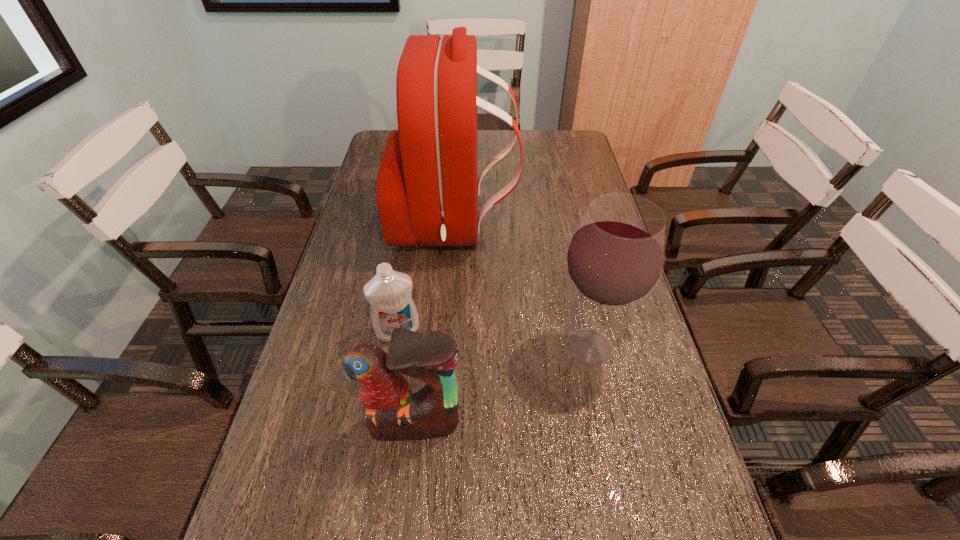
Where is `free point that satisfies the following two spatial constraints: 1. on the strap side of the third shortest object; 2. on the right side of the backpack`? free point that satisfies the following two spatial constraints: 1. on the strap side of the third shortest object; 2. on the right side of the backpack is located at coordinates (446, 347).

Find the location of a particular element. Image resolution: width=960 pixels, height=540 pixels. free spot that satisfies the following two spatial constraints: 1. on the strap side of the backpack; 2. on the right side of the third shortest object is located at coordinates (446, 347).